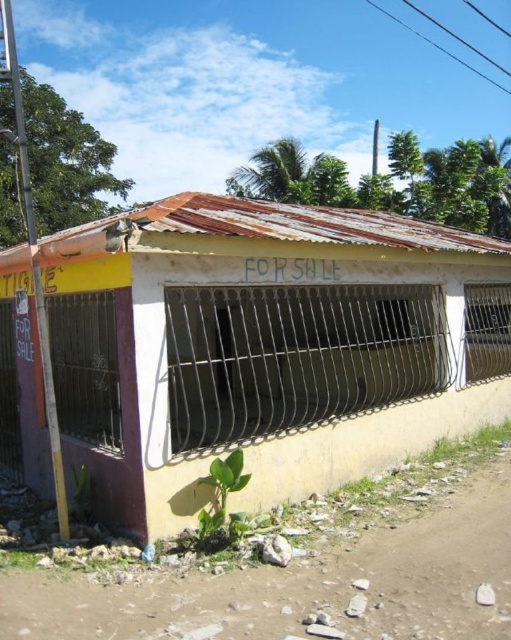
Question: Does yellow matte building at center come behind brown dirt track at lower left?

Choices:
 (A) yes
 (B) no

Answer: (A)

Question: Is yellow matte building at center to the left of brown dirt track at lower left from the viewer's perspective?

Choices:
 (A) no
 (B) yes

Answer: (B)

Question: Which of the following is the closest to the observer?

Choices:
 (A) yellow matte building at center
 (B) brown dirt track at lower left

Answer: (B)

Question: Can you confirm if yellow matte building at center is wider than brown dirt track at lower left?

Choices:
 (A) yes
 (B) no

Answer: (A)

Question: Which point is closer to the camera?

Choices:
 (A) (383, 236)
 (B) (322, 573)

Answer: (B)